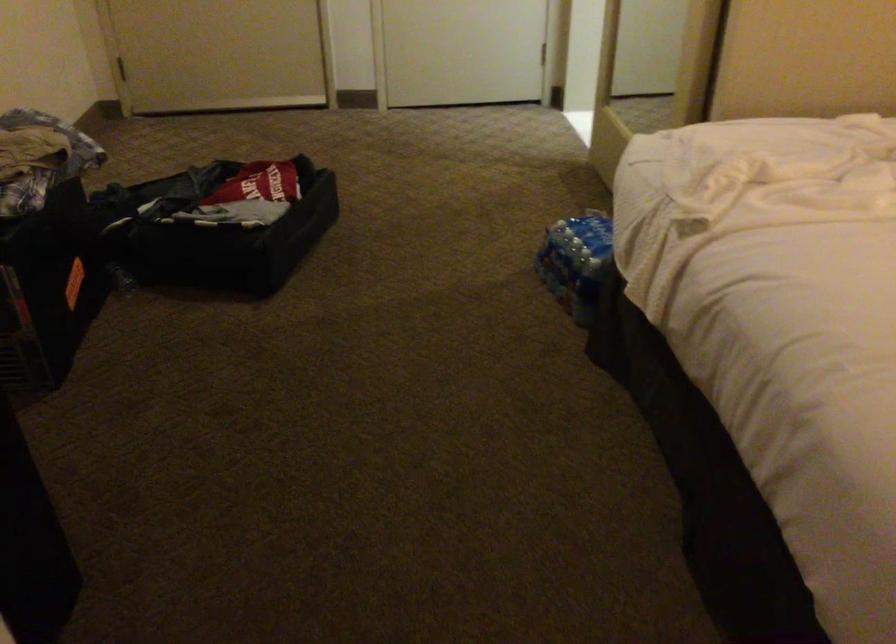
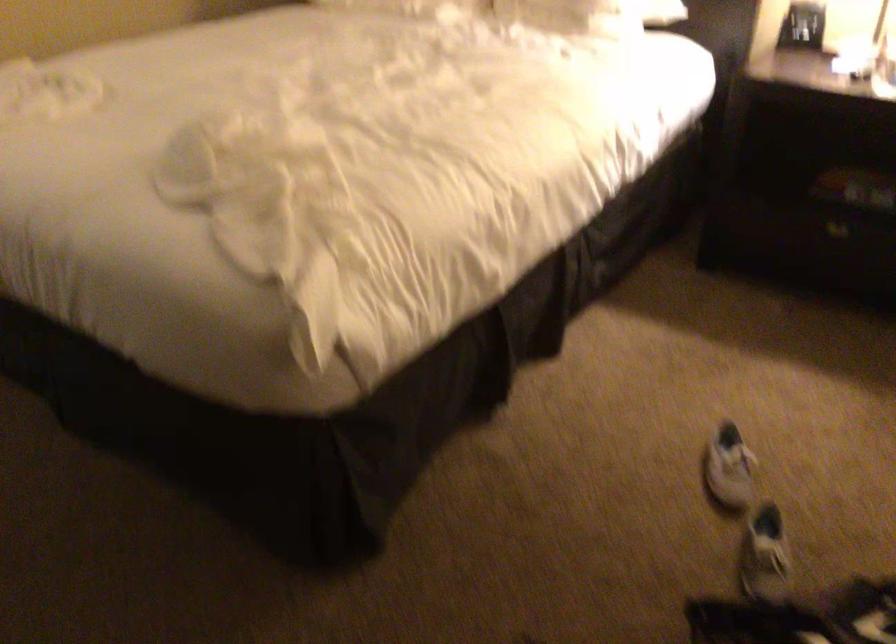
Question: The camera is either moving clockwise (left) or counter-clockwise (right) around the object. The first image is from the beginning of the video and the second image is from the end. Is the camera moving left or right when shooting the video?

Choices:
 (A) Left
 (B) Right

Answer: (A)